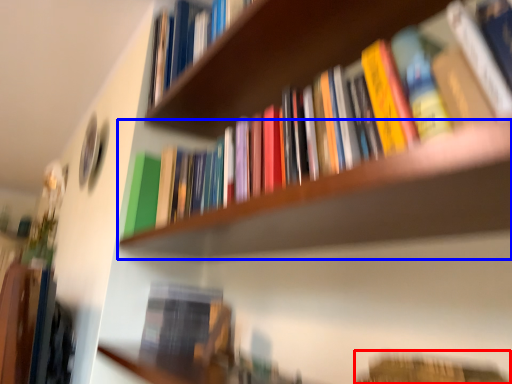
Question: Which point is closer to the camera, book (highlighted by a red box) or shelf (highlighted by a blue box)?

Choices:
 (A) book
 (B) shelf

Answer: (B)